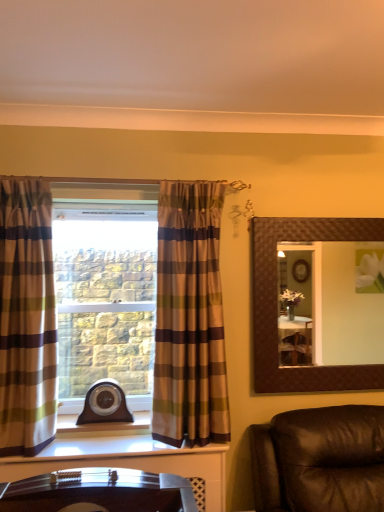
Question: Is plaid fabric curtain at left, positioned as the 1th curtain in right-to-left order, in front of brown textured mirror at upper right?

Choices:
 (A) no
 (B) yes

Answer: (B)

Question: Is plaid fabric curtain at left, positioned as the 1th curtain in right-to-left order, to the left of brown textured mirror at upper right from the viewer's perspective?

Choices:
 (A) yes
 (B) no

Answer: (A)

Question: Considering the relative sizes of plaid fabric curtain at left, which is the 2th curtain in left-to-right order, and brown textured mirror at upper right in the image provided, is plaid fabric curtain at left, which is the 2th curtain in left-to-right order, bigger than brown textured mirror at upper right?

Choices:
 (A) no
 (B) yes

Answer: (B)

Question: Does plaid fabric curtain at left, positioned as the 1th curtain in right-to-left order, have a smaller size compared to brown textured mirror at upper right?

Choices:
 (A) no
 (B) yes

Answer: (A)

Question: Is plaid fabric curtain at left, positioned as the 1th curtain in right-to-left order, positioned beyond the bounds of brown textured mirror at upper right?

Choices:
 (A) yes
 (B) no

Answer: (A)

Question: Considering the positions of brown textured mirror at upper right and plaid fabric curtain at left, the 2th curtain positioned from the right, in the image, is brown textured mirror at upper right taller or shorter than plaid fabric curtain at left, the 2th curtain positioned from the right,?

Choices:
 (A) tall
 (B) short

Answer: (B)

Question: Relative to plaid fabric curtain at left, the first curtain from the left, is brown textured mirror at upper right in front or behind?

Choices:
 (A) front
 (B) behind

Answer: (B)

Question: From a real-world perspective, is brown textured mirror at upper right above or below plaid fabric curtain at left, the 2th curtain positioned from the right?

Choices:
 (A) below
 (B) above

Answer: (A)

Question: Looking at the image, does brown textured mirror at upper right seem bigger or smaller compared to plaid fabric curtain at left, the first curtain from the left?

Choices:
 (A) big
 (B) small

Answer: (B)

Question: Would you say plaid fabric curtain at left, positioned as the 1th curtain in right-to-left order, is inside or outside brown textured mirror at upper right?

Choices:
 (A) outside
 (B) inside

Answer: (A)

Question: Is plaid fabric curtain at left, which is the 2th curtain in left-to-right order, taller or shorter than brown textured mirror at upper right?

Choices:
 (A) tall
 (B) short

Answer: (A)

Question: From the image's perspective, relative to brown textured mirror at upper right, is plaid fabric curtain at left, positioned as the 1th curtain in right-to-left order, above or below?

Choices:
 (A) below
 (B) above

Answer: (A)

Question: In terms of width, does plaid fabric curtain at left, which is the 2th curtain in left-to-right order, look wider or thinner when compared to brown textured mirror at upper right?

Choices:
 (A) wide
 (B) thin

Answer: (A)

Question: Is plaid fabric curtain at left, the 2th curtain positioned from the right, bigger or smaller than plaid fabric curtain at left, positioned as the 1th curtain in right-to-left order?

Choices:
 (A) big
 (B) small

Answer: (B)

Question: In terms of height, does plaid fabric curtain at left, the 2th curtain positioned from the right, look taller or shorter compared to plaid fabric curtain at left, positioned as the 1th curtain in right-to-left order?

Choices:
 (A) short
 (B) tall

Answer: (B)